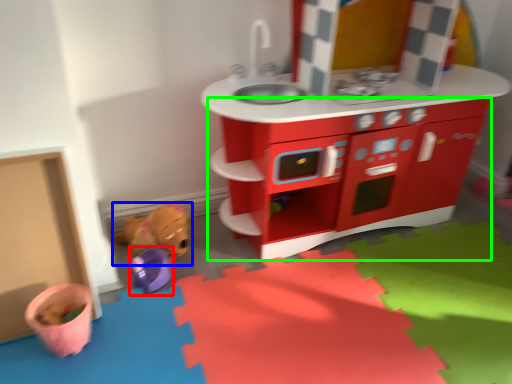
Question: Estimate the real-world distances between objects in this image. Which object is farther from toy (highlighted by a red box), toy (highlighted by a blue box) or cabinetry (highlighted by a green box)?

Choices:
 (A) toy
 (B) cabinetry

Answer: (B)